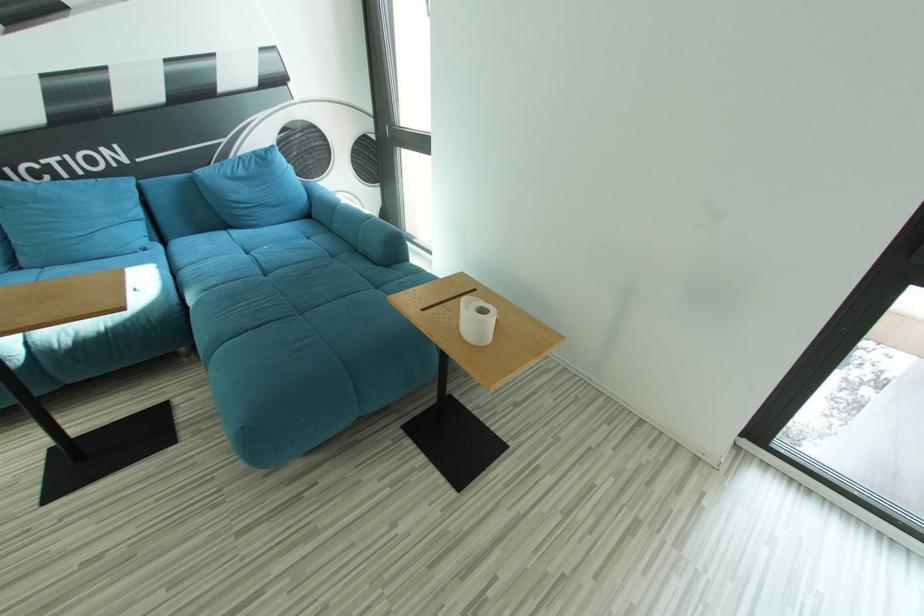
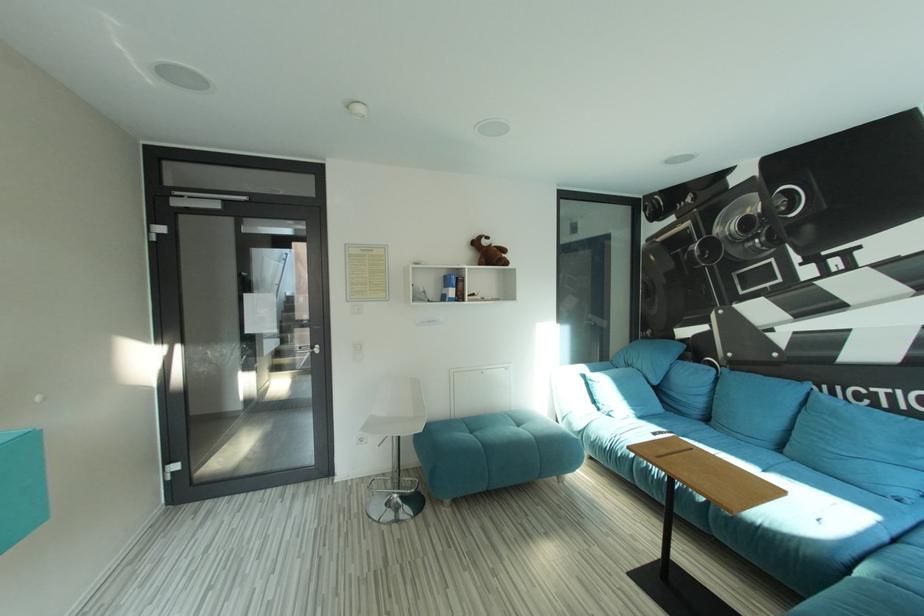
Question: The camera is either moving clockwise (left) or counter-clockwise (right) around the object. The first image is from the beginning of the video and the second image is from the end. Is the camera moving left or right when shooting the video?

Choices:
 (A) Left
 (B) Right

Answer: (B)